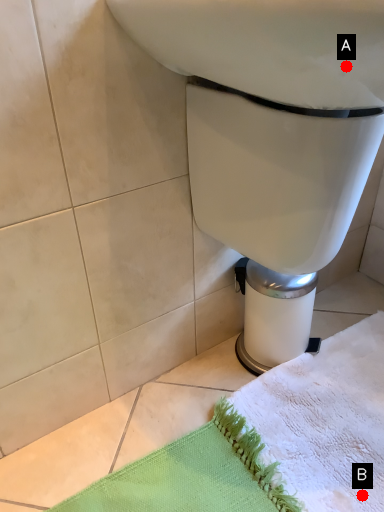
Question: Two points are circled on the image, labeled by A and B beside each circle. Which point is farther from the camera taking this photo?

Choices:
 (A) A is further
 (B) B is further

Answer: (B)